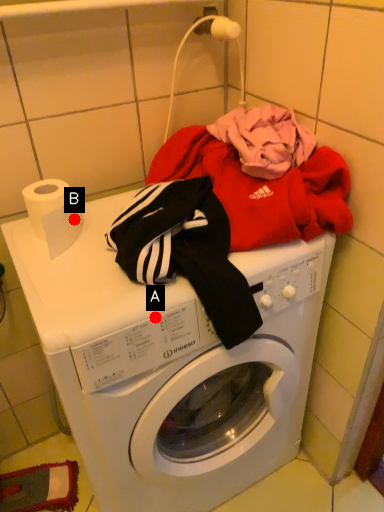
Question: Two points are circled on the image, labeled by A and B beside each circle. Which point is closer to the camera?

Choices:
 (A) A is closer
 (B) B is closer

Answer: (A)